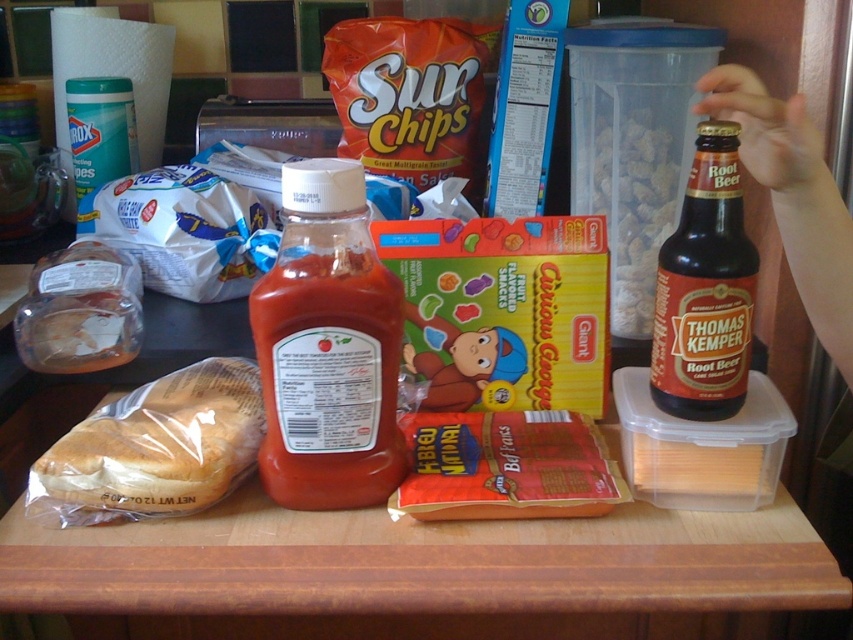
Question: Is translucent plastic bottle at center positioned in front of translucent plastic container at center-right?

Choices:
 (A) yes
 (B) no

Answer: (A)

Question: Observing the image, what is the correct spatial positioning of translucent plastic container at center-right in reference to translucent plastic sandwich at left?

Choices:
 (A) below
 (B) above

Answer: (B)

Question: Which point appears farthest from the camera in this image?

Choices:
 (A) (146, 410)
 (B) (257, 342)
 (C) (102, 314)
 (D) (679, 305)

Answer: (C)

Question: Estimate the real-world distances between objects in this image. Which object is closer to the translucent plastic container at center-right?

Choices:
 (A) brown glass bottle at right
 (B) translucent plastic sandwich at left
 (C) translucent plastic bottle at center

Answer: (A)

Question: Can you confirm if translucent plastic sandwich at center left is thinner than translucent plastic sandwich at left?

Choices:
 (A) no
 (B) yes

Answer: (A)

Question: Among these points, which one is farthest from the camera?

Choices:
 (A) click(361, 461)
 (B) click(737, 340)
 (C) click(177, 400)

Answer: (C)